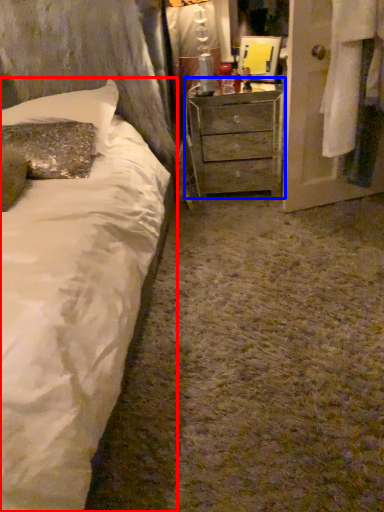
Question: Which object appears closest to the camera in this image, bed (highlighted by a red box) or chest of drawers (highlighted by a blue box)?

Choices:
 (A) bed
 (B) chest of drawers

Answer: (A)